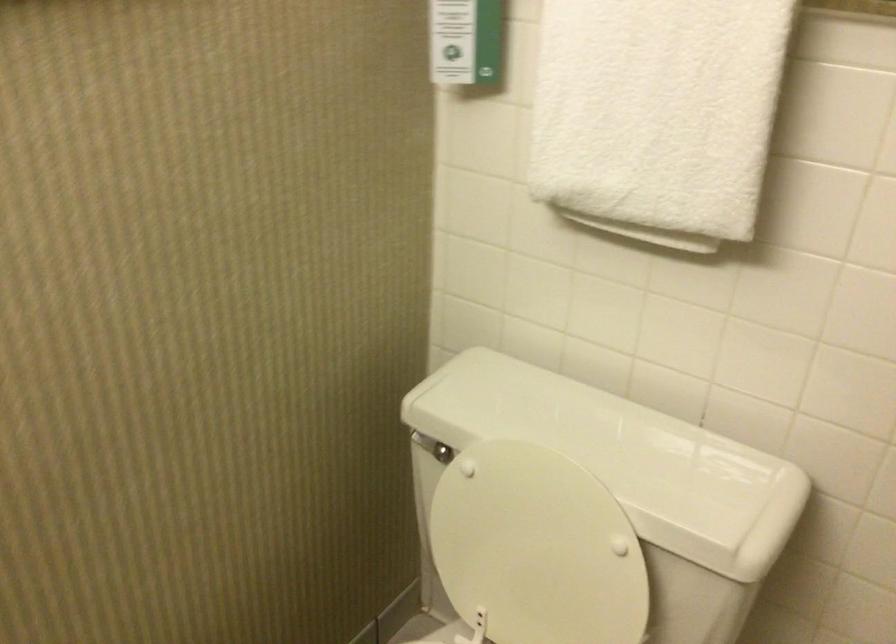
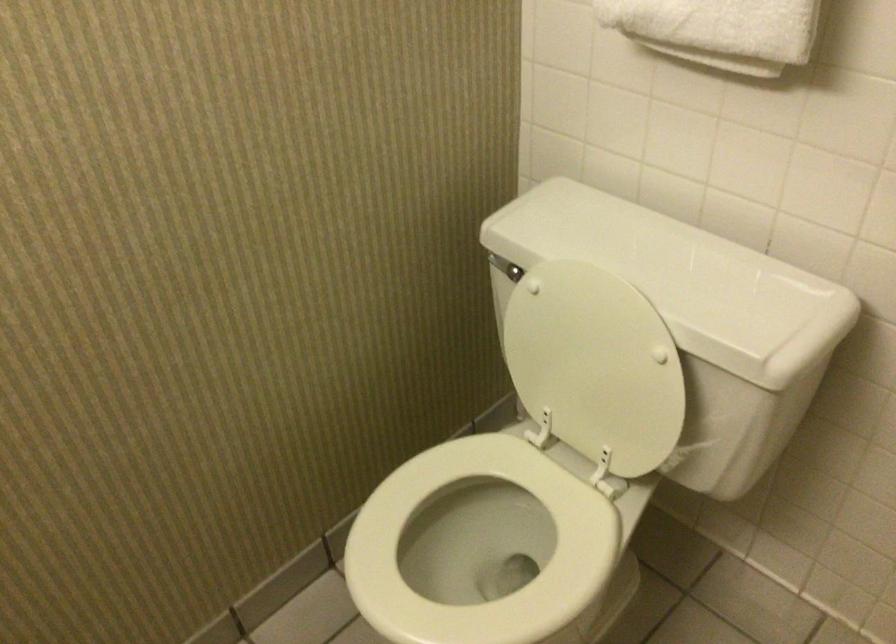
Question: Based on the continuous images, in which direction is the camera rotating? Reply with the corresponding letter.

Choices:
 (A) Left
 (B) Right
 (C) Up
 (D) Down

Answer: (A)